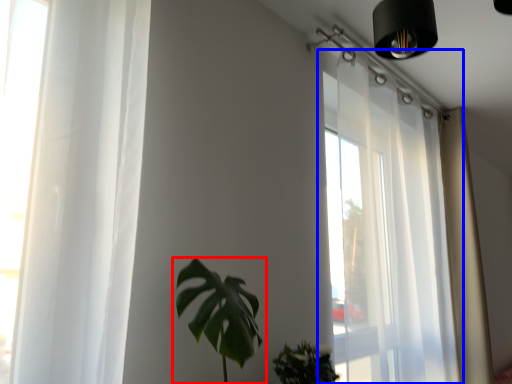
Question: Which point is further to the camera, houseplant (highlighted by a red box) or window (highlighted by a blue box)?

Choices:
 (A) houseplant
 (B) window

Answer: (B)